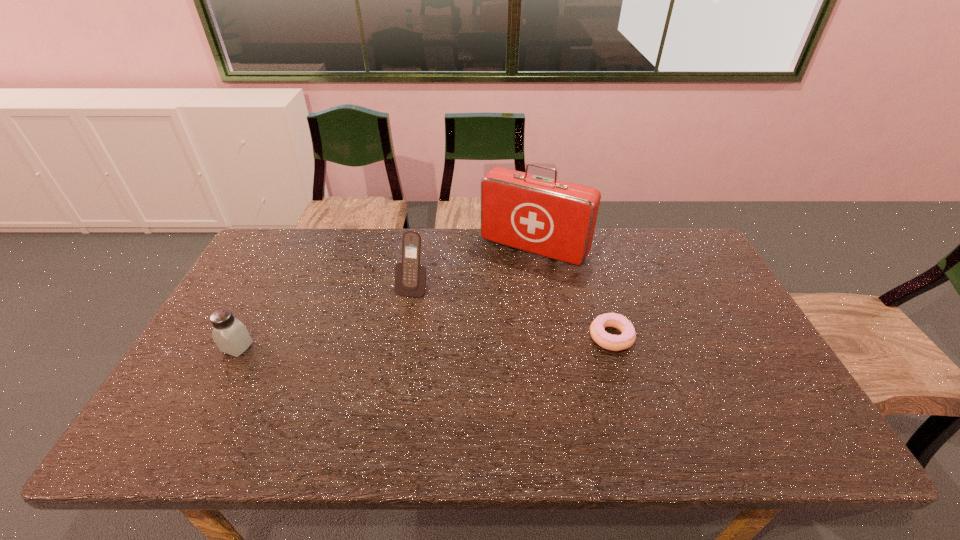
Locate an element on the screen. The height and width of the screenshot is (540, 960). vacant area at the far left corner is located at coordinates (259, 269).

I want to click on vacant space at the far right corner of the desktop, so click(x=664, y=227).

Identify the location of empty location between the doughnut and the tallest object. (572, 293).

Where is `vacant space that's between the tallest object and the doughnut`? vacant space that's between the tallest object and the doughnut is located at coordinates (572, 293).

Where is `free space between the leftmost object and the second farthest object`? free space between the leftmost object and the second farthest object is located at coordinates (324, 317).

Where is `vacant area that lies between the saltshaker and the tallest object`? vacant area that lies between the saltshaker and the tallest object is located at coordinates (386, 298).

The height and width of the screenshot is (540, 960). Find the location of `empty space between the farthest object and the doughnut`. empty space between the farthest object and the doughnut is located at coordinates (572, 293).

In order to click on free space between the doughnut and the third tallest object in this screenshot , I will do `click(424, 342)`.

The image size is (960, 540). I want to click on free spot between the farthest object and the cellular telephone, so click(473, 268).

Locate an element on the screen. The height and width of the screenshot is (540, 960). free space between the third tallest object and the shortest object is located at coordinates (424, 342).